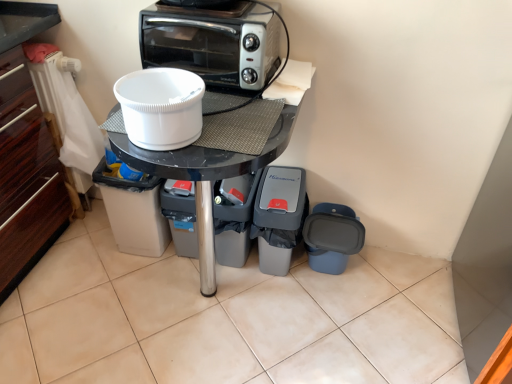
The width and height of the screenshot is (512, 384). I want to click on vacant space situated on the left part of white plastic bucket at center, the first appliance in the left-to-right sequence, so click(80, 243).